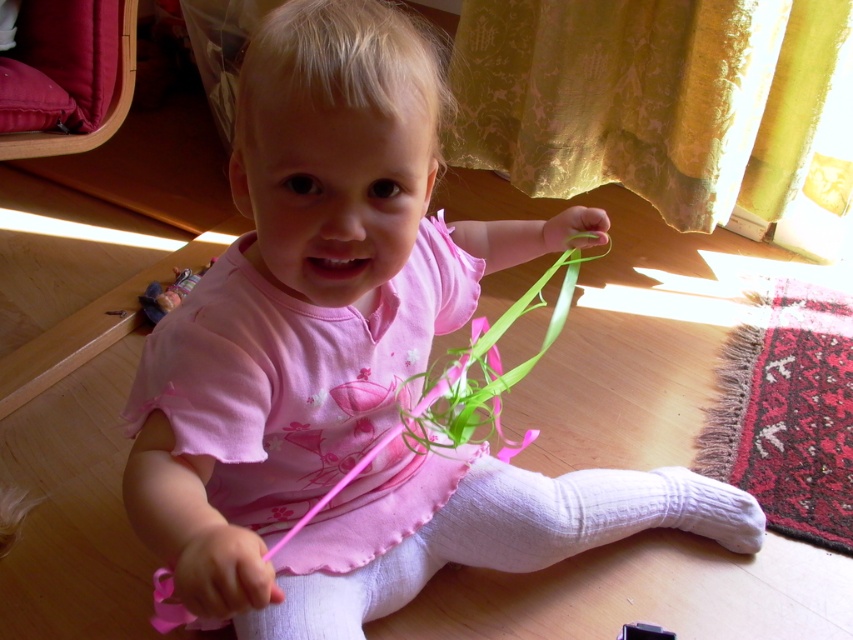
Question: Can you confirm if green silky ribbon at center is positioned below striped fabric doll at left?

Choices:
 (A) yes
 (B) no

Answer: (A)

Question: Among these points, which one is nearest to the camera?

Choices:
 (A) (183, 292)
 (B) (178, 616)

Answer: (B)

Question: Which of the following is the closest to the observer?

Choices:
 (A) striped fabric doll at left
 (B) green silky ribbon at center

Answer: (B)

Question: From the image, what is the correct spatial relationship of green silky ribbon at center in relation to striped fabric doll at left?

Choices:
 (A) left
 (B) right

Answer: (B)

Question: Is green silky ribbon at center below striped fabric doll at left?

Choices:
 (A) no
 (B) yes

Answer: (B)

Question: Among these points, which one is farthest from the camera?

Choices:
 (A) (144, 296)
 (B) (573, 275)

Answer: (A)